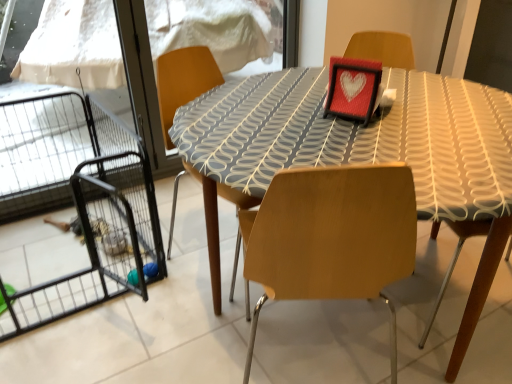
Question: Considering the positions of matte gray fabric table at center and black wire cage at left in the image, is matte gray fabric table at center wider or thinner than black wire cage at left?

Choices:
 (A) thin
 (B) wide

Answer: (B)

Question: Is point (416, 142) positioned closer to the camera than point (128, 145)?

Choices:
 (A) closer
 (B) farther

Answer: (A)

Question: Considering the relative positions of matte gray fabric table at center and black wire cage at left in the image provided, is matte gray fabric table at center to the left or to the right of black wire cage at left?

Choices:
 (A) right
 (B) left

Answer: (A)

Question: Based on their positions, is black wire cage at left located to the left or right of matte gray fabric table at center?

Choices:
 (A) left
 (B) right

Answer: (A)

Question: Choose the correct answer: Is black wire cage at left inside matte gray fabric table at center or outside it?

Choices:
 (A) outside
 (B) inside

Answer: (A)

Question: Is black wire cage at left wider or thinner than matte gray fabric table at center?

Choices:
 (A) wide
 (B) thin

Answer: (B)

Question: From a real-world perspective, is black wire cage at left physically located above or below matte gray fabric table at center?

Choices:
 (A) below
 (B) above

Answer: (A)